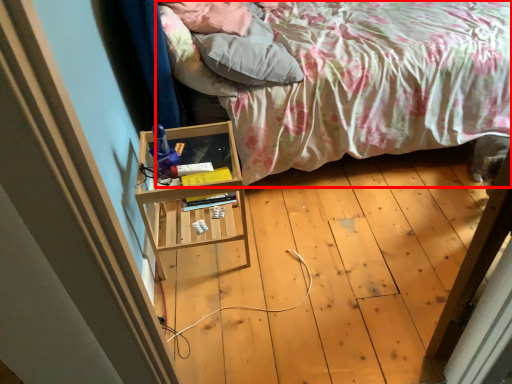
Question: Where is bed (annotated by the red box) located in relation to pillow in the image?

Choices:
 (A) left
 (B) right

Answer: (B)